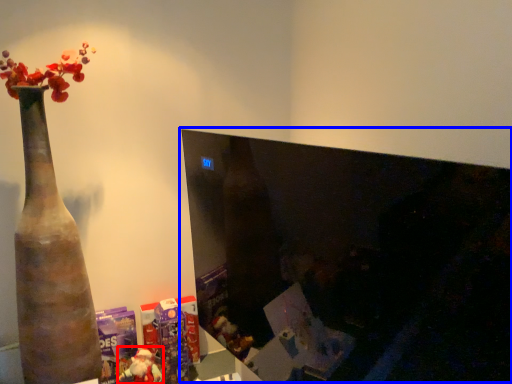
Question: Which object is closer to the camera taking this photo, toy (highlighted by a red box) or computer monitor (highlighted by a blue box)?

Choices:
 (A) toy
 (B) computer monitor

Answer: (B)